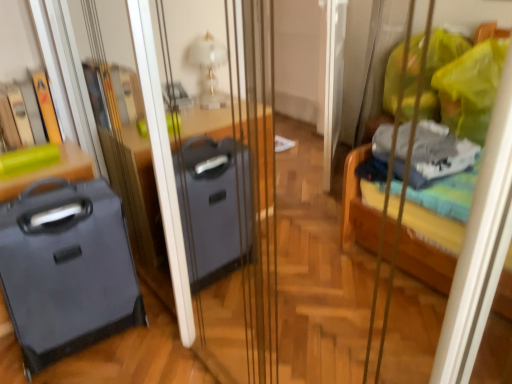
Locate an element on the screen. The image size is (512, 384). vacant space to the right of matte black suitcase at left is located at coordinates (159, 350).